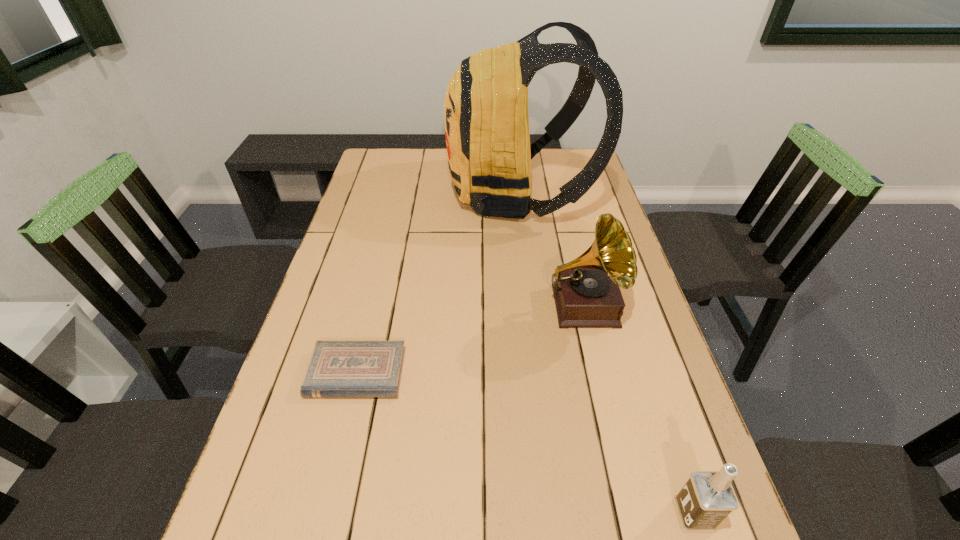
Find the location of a particular element. This screenshot has height=540, width=960. vacant area situated 0.270m on the front-facing side of the backpack is located at coordinates (371, 194).

Where is `vacant space located 0.400m from the horn of the third nearest object`? vacant space located 0.400m from the horn of the third nearest object is located at coordinates (636, 531).

Where is `vacant position located on the front label of the vodka`? This screenshot has width=960, height=540. vacant position located on the front label of the vodka is located at coordinates point(450,515).

You are a GUI agent. You are given a task and a screenshot of the screen. Output one action in this format:
    pyautogui.click(x=<x>, y=<y>)
    Task: Click on the free point located on the front label of the vodka
    The width and height of the screenshot is (960, 540).
    Given the screenshot: What is the action you would take?
    pyautogui.click(x=558, y=515)

The width and height of the screenshot is (960, 540). I want to click on free region located on the front label of the vodka, so click(517, 515).

Image resolution: width=960 pixels, height=540 pixels. What are the coordinates of `free location located 0.240m on the spine side of the shortest object` in the screenshot? It's located at (322, 522).

The width and height of the screenshot is (960, 540). In order to click on object that is at the far edge in this screenshot , I will do `click(486, 118)`.

Find the location of a particular element. The width and height of the screenshot is (960, 540). object present at the left edge is located at coordinates (336, 368).

Where is `backpack present at the right edge`? The image size is (960, 540). backpack present at the right edge is located at coordinates [x=486, y=118].

The width and height of the screenshot is (960, 540). Find the location of `phonograph record located at the right edge`. phonograph record located at the right edge is located at coordinates (586, 290).